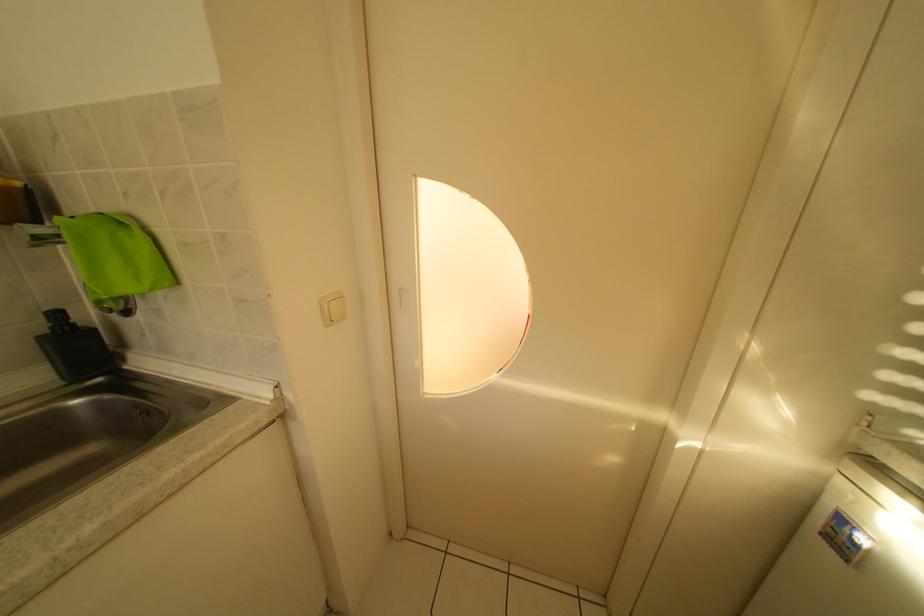
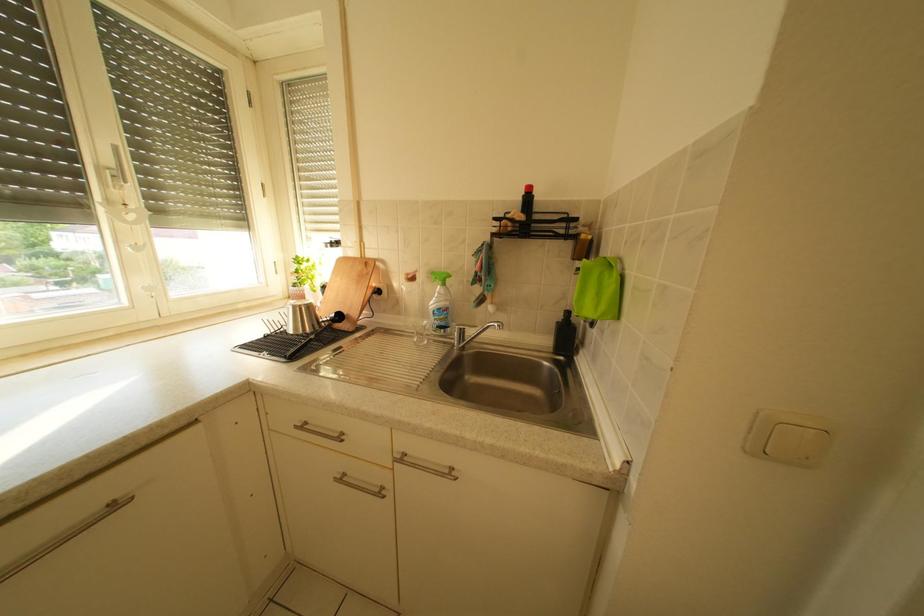
Question: The first image is from the beginning of the video and the second image is from the end. How did the camera likely rotate when shooting the video?

Choices:
 (A) Left
 (B) Right
 (C) Up
 (D) Down

Answer: (A)